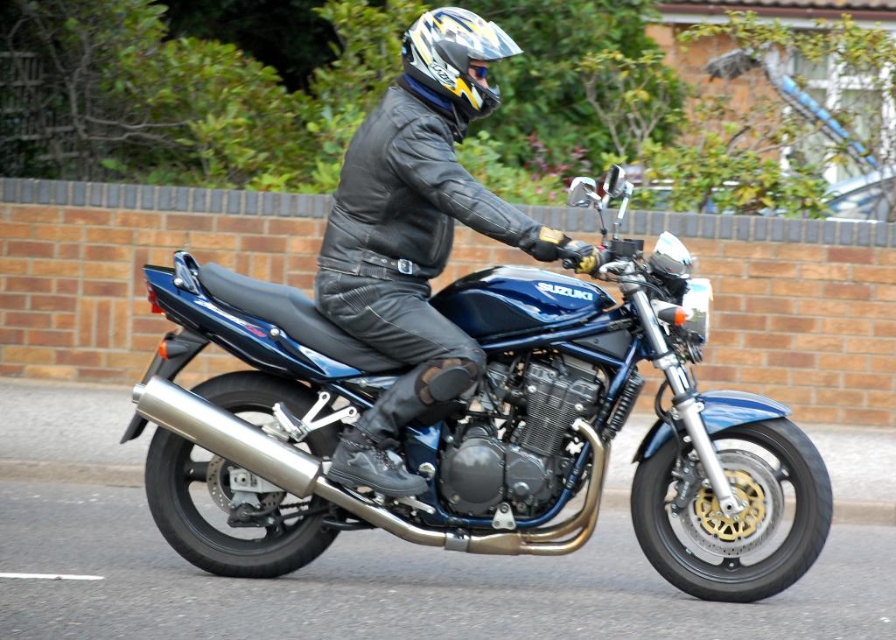
Can you confirm if matte black leather jacket at center is taller than shiny multicolored helmet at center?

Yes, matte black leather jacket at center is taller than shiny multicolored helmet at center.

Is point (394, 294) more distant than point (470, 20)?

Yes, it is behind point (470, 20).

Does point (449, 381) lie behind point (458, 40)?

No.

Find the location of a particular element. The image size is (896, 640). matte black leather jacket at center is located at coordinates (418, 234).

Can you confirm if blue metallic motorcycle at center is smaller than shiny multicolored helmet at center?

No, blue metallic motorcycle at center is not smaller than shiny multicolored helmet at center.

Can you confirm if blue metallic motorcycle at center is positioned to the left of shiny multicolored helmet at center?

In fact, blue metallic motorcycle at center is to the right of shiny multicolored helmet at center.

Image resolution: width=896 pixels, height=640 pixels. Find the location of `blue metallic motorcycle at center`. blue metallic motorcycle at center is located at coordinates (477, 422).

Find the location of a particular element. This screenshot has width=896, height=640. blue metallic motorcycle at center is located at coordinates (477, 422).

Which is more to the right, blue metallic motorcycle at center or matte black leather jacket at center?

Positioned to the right is blue metallic motorcycle at center.

Between blue metallic motorcycle at center and matte black leather jacket at center, which one is positioned lower?

Positioned lower is blue metallic motorcycle at center.

Which is behind, point (224, 557) or point (452, 339)?

The point (224, 557) is behind.

Find the location of a particular element. Image resolution: width=896 pixels, height=640 pixels. blue metallic motorcycle at center is located at coordinates (477, 422).